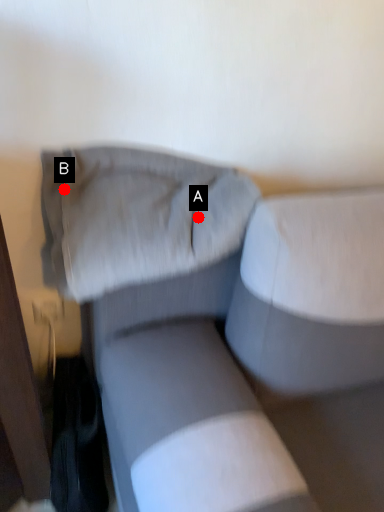
Question: Two points are circled on the image, labeled by A and B beside each circle. Which point is farther to the camera?

Choices:
 (A) A is further
 (B) B is further

Answer: (B)